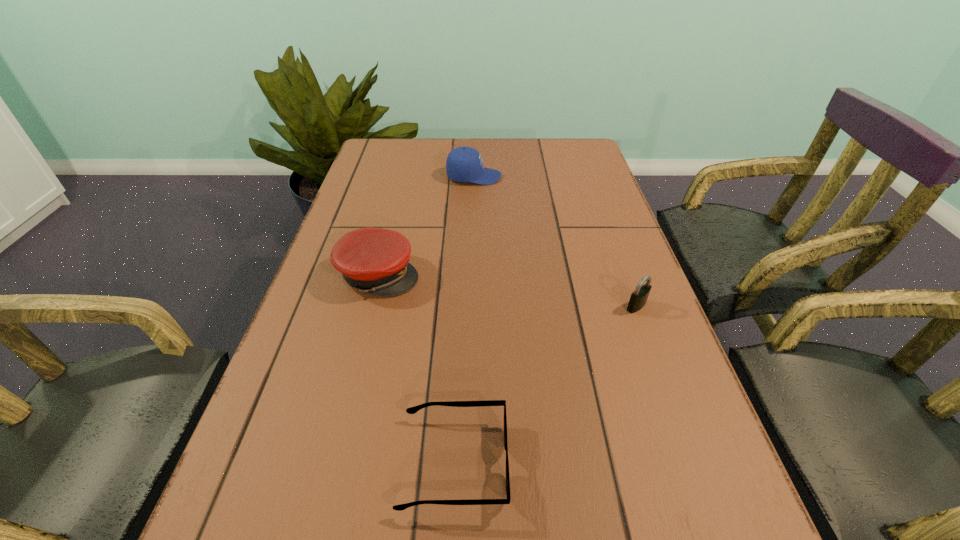
The image size is (960, 540). I want to click on the farthest object, so click(x=464, y=164).

The width and height of the screenshot is (960, 540). Find the location of `the farther cap`. the farther cap is located at coordinates (464, 164).

You are a GUI agent. You are given a task and a screenshot of the screen. Output one action in this format:
    pyautogui.click(x=<x>, y=<y>)
    Task: Click on the left cap
    The image size is (960, 540).
    Given the screenshot: What is the action you would take?
    pyautogui.click(x=375, y=260)

This screenshot has height=540, width=960. Find the location of `the nearer cap`. the nearer cap is located at coordinates (375, 260).

At what (x,y) coordinates should I click in order to perform the action: click on the rightmost object. Please return your answer as a coordinate pair (x, y). This screenshot has height=540, width=960. Looking at the image, I should click on (638, 299).

This screenshot has height=540, width=960. I want to click on spectacles, so click(412, 410).

Identify the location of the nearest object. (412, 410).

The width and height of the screenshot is (960, 540). In order to click on free space located 0.300m on the front-facing side of the farther cap in this screenshot , I will do `click(601, 177)`.

I want to click on free location located 0.050m on the front of the leftmost object with an emblem, so click(441, 275).

Identify the location of free region located on the front of the rightmost object. The image size is (960, 540). tap(655, 356).